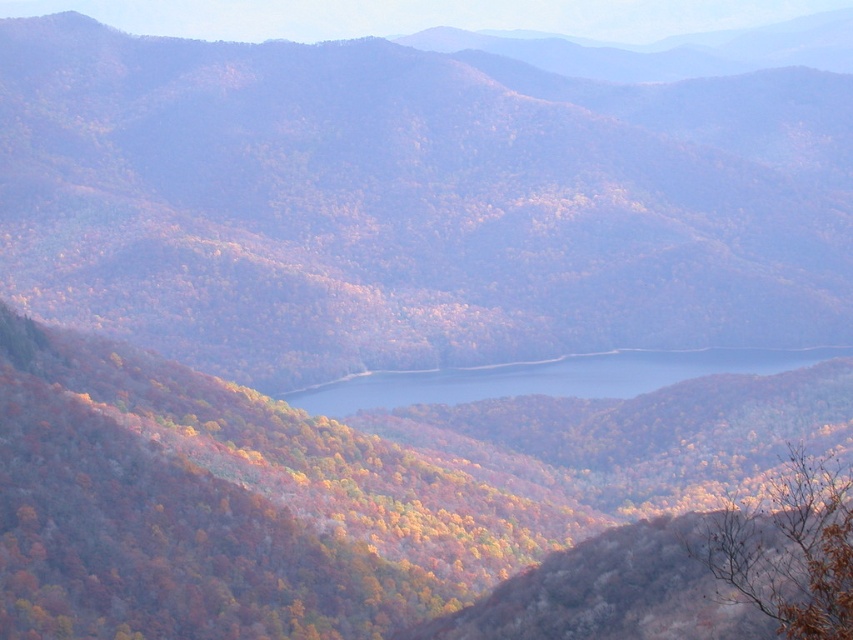
Which is in front, point (276, 168) or point (809, 356)?

Point (809, 356)

Who is more distant from viewer, (164, 77) or (846, 353)?

The point (164, 77) is behind.

The height and width of the screenshot is (640, 853). I want to click on brown matte forest at center, so click(x=410, y=204).

Does brown matte forest at center have a lesser width compared to autumn leaves at center?

In fact, brown matte forest at center might be wider than autumn leaves at center.

Can you confirm if brown matte forest at center is smaller than autumn leaves at center?

No, brown matte forest at center is not smaller than autumn leaves at center.

Looking at this image, who is more distant from viewer, (723,220) or (556,477)?

The point (723,220) is more distant.

Where is `brown matte forest at center`? brown matte forest at center is located at coordinates (410, 204).

Does brown matte tree at lower right lie in front of blue glassy water at center?

Yes.

Is brown matte tree at lower right wider than blue glassy water at center?

No.

I want to click on brown matte tree at lower right, so point(788,547).